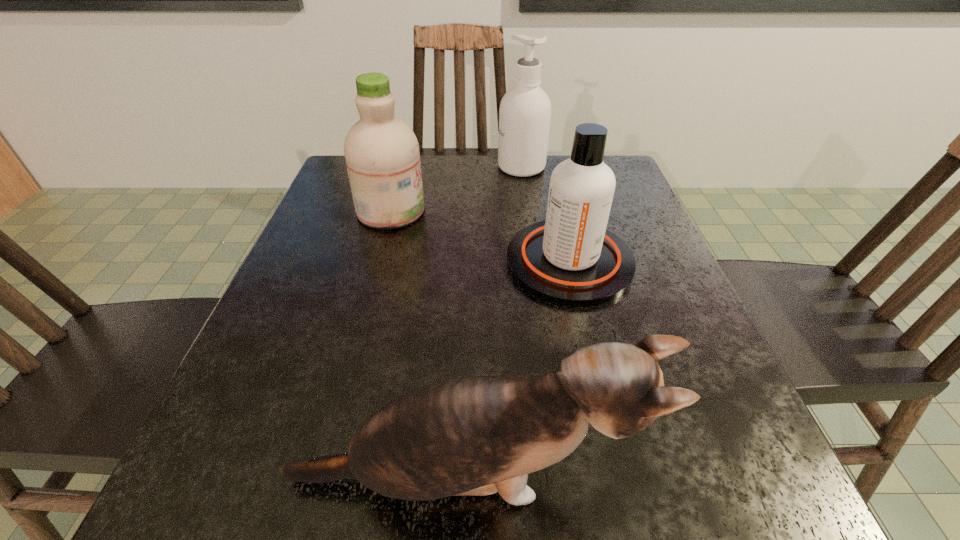
You are a GUI agent. You are given a task and a screenshot of the screen. Output one action in this format:
    pyautogui.click(x=<x>, y=<y>)
    Task: Click on the farthest object
    
    Given the screenshot: What is the action you would take?
    pyautogui.click(x=525, y=110)

Where is `the leftmost cleansing agent`? the leftmost cleansing agent is located at coordinates (382, 156).

Where is `the nearest object`? This screenshot has width=960, height=540. the nearest object is located at coordinates (472, 436).

Find the location of a particular element. free spot located 0.230m on the front label of the farthest cleansing agent is located at coordinates (410, 167).

Where is `vacant space situated 0.270m on the front label of the farthest cleansing agent`? This screenshot has height=540, width=960. vacant space situated 0.270m on the front label of the farthest cleansing agent is located at coordinates (395, 167).

You are a GUI agent. You are given a task and a screenshot of the screen. Output one action in this format:
    pyautogui.click(x=<x>, y=<y>)
    Task: Click on the free space located on the front label of the farthest cleansing agent
    
    Given the screenshot: What is the action you would take?
    point(418,167)

This screenshot has width=960, height=540. I want to click on vacant region located on the front label of the leftmost cleansing agent, so click(x=552, y=211).

Find the location of a particular element. Image resolution: width=960 pixels, height=540 pixels. free space located at the face of the nearest object is located at coordinates (682, 479).

The width and height of the screenshot is (960, 540). What are the coordinates of `object that is at the near edge` in the screenshot? It's located at (472, 436).

You are a GUI agent. You are given a task and a screenshot of the screen. Output one action in this format:
    pyautogui.click(x=<x>, y=<y>)
    Task: Click on the cleansing agent located in the left edge section of the desktop
    This screenshot has height=540, width=960.
    Given the screenshot: What is the action you would take?
    pyautogui.click(x=382, y=156)